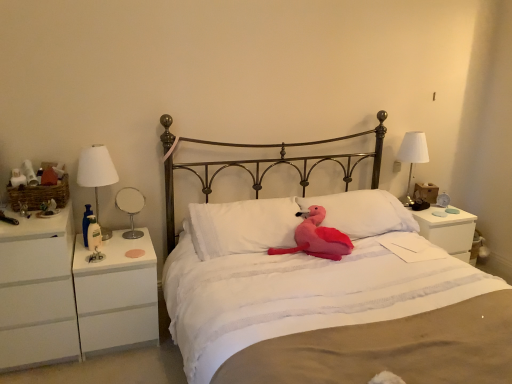
Question: From the image's perspective, is white soft pillow at center, positioned as the second pillow in left-to-right order, on top of pink plush toy at center?

Choices:
 (A) no
 (B) yes

Answer: (B)

Question: Is white soft pillow at center, the 1th pillow in the right-to-left sequence, at the left side of pink plush toy at center?

Choices:
 (A) yes
 (B) no

Answer: (B)

Question: Could pink plush toy at center be considered to be inside white soft pillow at center, the 1th pillow in the right-to-left sequence?

Choices:
 (A) no
 (B) yes

Answer: (A)

Question: Is white soft pillow at center, positioned as the second pillow in left-to-right order, closer to the viewer compared to pink plush toy at center?

Choices:
 (A) no
 (B) yes

Answer: (A)

Question: From the image's perspective, is white fabric lampshade at right, placed as the 1th bedside lamp when sorted from back to front, located above or below white soft pillow at center, positioned as the second pillow in left-to-right order?

Choices:
 (A) below
 (B) above

Answer: (B)

Question: Relative to white soft pillow at center, positioned as the second pillow in left-to-right order, is white fabric lampshade at right, placed as the 1th bedside lamp when sorted from back to front, in front or behind?

Choices:
 (A) behind
 (B) front

Answer: (A)

Question: Would you say white fabric lampshade at right, which appears as the first bedside lamp when viewed from the right, is inside or outside white soft pillow at center, the 1th pillow in the right-to-left sequence?

Choices:
 (A) outside
 (B) inside

Answer: (A)

Question: From a real-world perspective, is white fabric lampshade at right, which appears as the first bedside lamp when viewed from the right, above or below white soft pillow at center, positioned as the second pillow in left-to-right order?

Choices:
 (A) below
 (B) above

Answer: (B)

Question: Which is correct: white matte nightstand at right, the 1th nightstand positioned from the right, is inside white soft pillow at center, acting as the second pillow starting from the right, or outside of it?

Choices:
 (A) outside
 (B) inside

Answer: (A)

Question: Is point (466, 253) closer or farther from the camera than point (207, 246)?

Choices:
 (A) closer
 (B) farther

Answer: (B)

Question: Considering the positions of white matte nightstand at right, the 1th nightstand positioned from the right, and white soft pillow at center, acting as the second pillow starting from the right, in the image, is white matte nightstand at right, the 1th nightstand positioned from the right, taller or shorter than white soft pillow at center, acting as the second pillow starting from the right,?

Choices:
 (A) short
 (B) tall

Answer: (B)

Question: Is white matte nightstand at right, the 1th nightstand positioned from the right, bigger or smaller than white soft pillow at center, arranged as the first pillow when viewed from the left?

Choices:
 (A) small
 (B) big

Answer: (B)

Question: Considering the positions of point (362, 228) and point (415, 306), is point (362, 228) closer or farther from the camera than point (415, 306)?

Choices:
 (A) closer
 (B) farther

Answer: (B)

Question: From a real-world perspective, relative to pink plush toy at center, is white soft pillow at center, the 1th pillow in the right-to-left sequence, vertically above or below?

Choices:
 (A) above
 (B) below

Answer: (A)